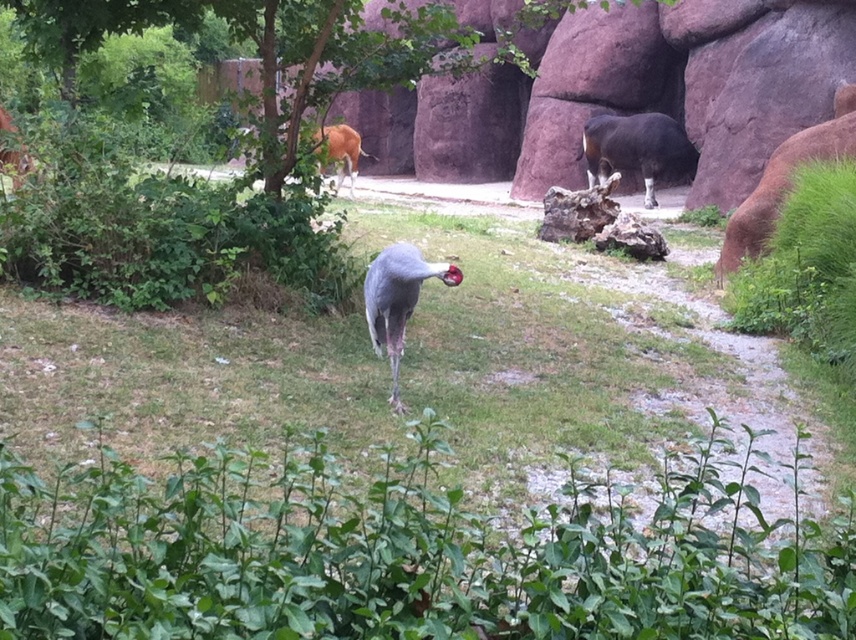
Is green leafy tree at upper center smaller than gray matte bird at center?

No, green leafy tree at upper center is not smaller than gray matte bird at center.

Which is behind, point (648, 189) or point (409, 253)?

Positioned behind is point (648, 189).

Where is `green leafy tree at upper center`? green leafy tree at upper center is located at coordinates (268, 48).

Can you confirm if green leafy tree at upper center is smaller than brown glossy antelope at upper center?

No, green leafy tree at upper center is not smaller than brown glossy antelope at upper center.

Is point (419, 35) more distant than point (352, 170)?

No, (419, 35) is in front of (352, 170).

The height and width of the screenshot is (640, 856). I want to click on green leafy tree at upper center, so click(268, 48).

How distant is shiny black cow at center from gray matte bird at center?

shiny black cow at center is 5.22 meters away from gray matte bird at center.

Is point (623, 134) farther from camera compared to point (395, 248)?

Yes, point (623, 134) is behind point (395, 248).

Where is `shiny black cow at center`? shiny black cow at center is located at coordinates (x=635, y=148).